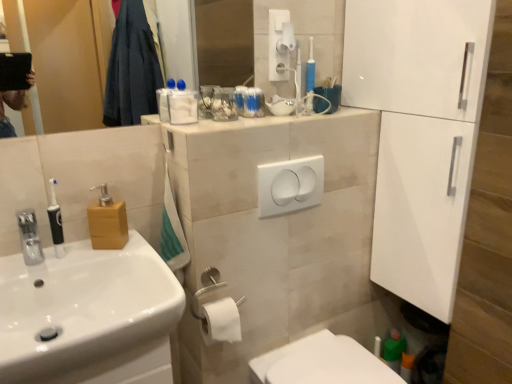
Question: Considering the positions of point (404, 71) and point (288, 31), is point (404, 71) closer or farther from the camera than point (288, 31)?

Choices:
 (A) farther
 (B) closer

Answer: (B)

Question: From their relative heights in the image, would you say white glossy cabinet at right is taller or shorter than white matte toilet paper at upper center, acting as the first toilet paper starting from the top?

Choices:
 (A) short
 (B) tall

Answer: (B)

Question: Considering the real-world distances, which object is closest to the white matte toilet paper at lower center, the second toilet paper viewed from the back?

Choices:
 (A) beige tile counter at upper center
 (B) clear glass mirror at upper left
 (C) wooden soap dispenser at left
 (D) white glossy cabinet at right
 (E) white matte toilet paper at upper center, acting as the first toilet paper starting from the top

Answer: (C)

Question: Which of these objects is positioned closest to the beige tile counter at upper center?

Choices:
 (A) clear glass mirror at upper left
 (B) white glossy toilet at lower center
 (C) white matte toilet paper at lower center, positioned as the 1th toilet paper in left-to-right order
 (D) translucent plastic toothbrushes at upper center, which is the 2th toiletry from front to back
 (E) white plastic light switch at center

Answer: (E)